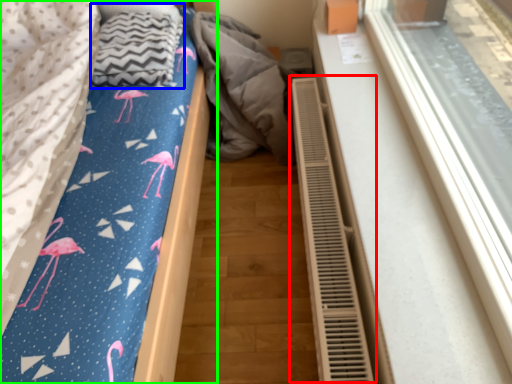
Question: Considering the real-world distances, which object is farthest from air conditioner (highlighted by a red box)? blanket (highlighted by a blue box) or bed (highlighted by a green box)?

Choices:
 (A) blanket
 (B) bed

Answer: (A)